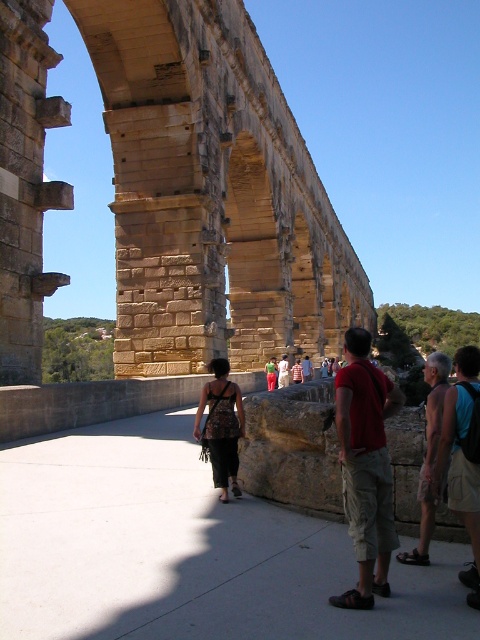
Question: Can you confirm if textured brown dress at center is positioned to the right of brown leather backpack at center?

Choices:
 (A) yes
 (B) no

Answer: (B)

Question: Which of the following is the farthest from the observer?

Choices:
 (A) tan shorts at lower right
 (B) brown leather backpack at center
 (C) red cotton shirt at center

Answer: (B)

Question: Among these points, which one is nearest to the camera?

Choices:
 (A) (393, 390)
 (B) (223, 502)
 (C) (271, 356)

Answer: (A)

Question: Does textured brown dress at center appear under green fabric dress at center?

Choices:
 (A) no
 (B) yes

Answer: (A)

Question: Which object is positioned farthest from the brown leather backpack at center?

Choices:
 (A) tan shorts at lower right
 (B) red cotton shirt at center
 (C) khaki cotton shorts at lower right
 (D) textured brown dress at center

Answer: (C)

Question: Can you confirm if green fabric dress at center is bigger than brown leather backpack at center?

Choices:
 (A) yes
 (B) no

Answer: (A)